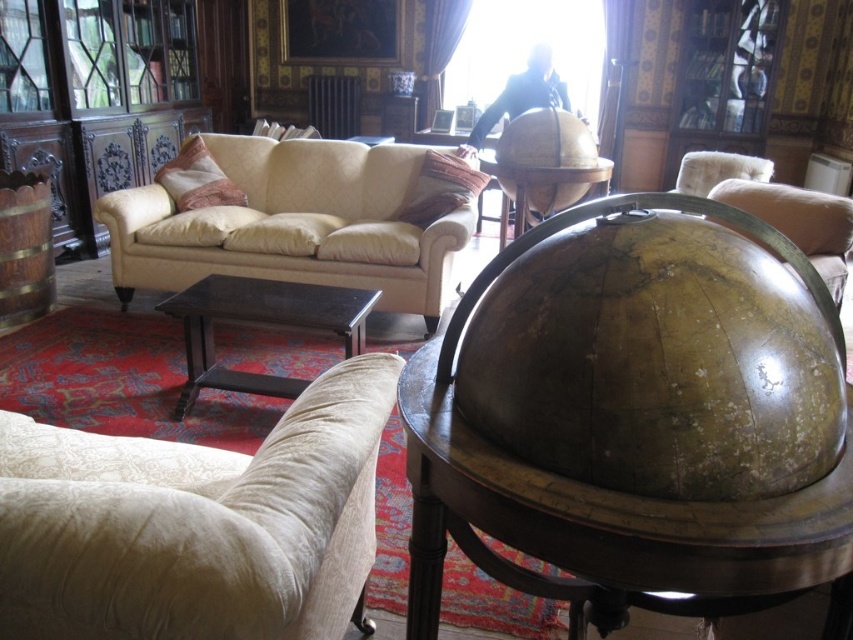
Can you confirm if velvet beige armchair at lower left is smaller than beige fabric couch at center?

Yes, velvet beige armchair at lower left is smaller than beige fabric couch at center.

Does velvet beige armchair at lower left appear on the left side of beige fabric couch at center?

No, velvet beige armchair at lower left is not to the left of beige fabric couch at center.

You are a GUI agent. You are given a task and a screenshot of the screen. Output one action in this format:
    pyautogui.click(x=<x>, y=<y>)
    Task: Click on the velvet beige armchair at lower left
    The height and width of the screenshot is (640, 853).
    Given the screenshot: What is the action you would take?
    pyautogui.click(x=195, y=524)

Is shiny brown globe at center bigger than beige fabric couch at center?

No, shiny brown globe at center is not bigger than beige fabric couch at center.

Who is more forward, [460,483] or [257,272]?

Point [460,483] is in front.

Find the location of `shiny brown globe at center`. shiny brown globe at center is located at coordinates (608, 529).

Who is positioned more to the right, shiny brown globe at center or dark wood table at center?

From the viewer's perspective, shiny brown globe at center appears more on the right side.

Who is taller, shiny brown globe at center or dark wood table at center?

With more height is shiny brown globe at center.

Locate an element on the screen. shiny brown globe at center is located at coordinates (608, 529).